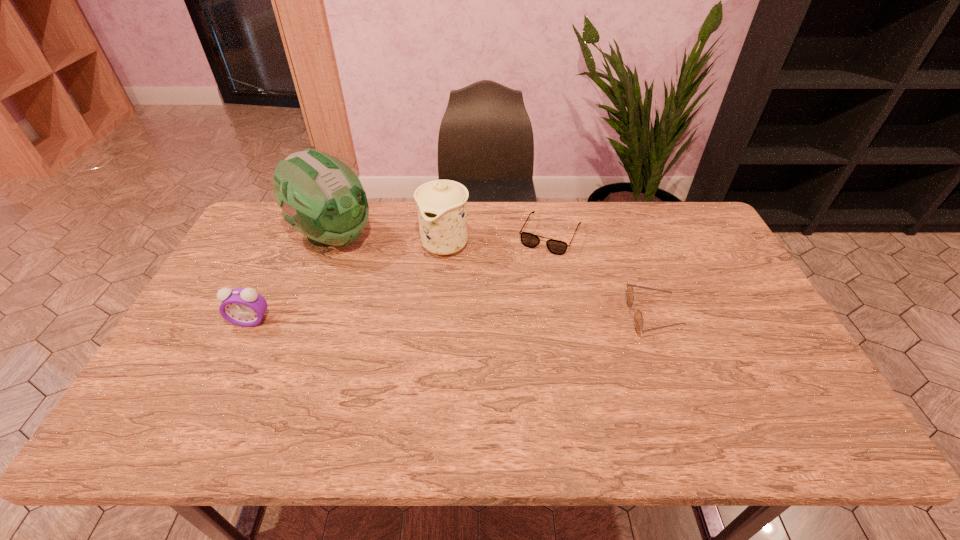
The height and width of the screenshot is (540, 960). Find the location of `football helmet located at the far edge`. football helmet located at the far edge is located at coordinates (321, 197).

You are a GUI agent. You are given a task and a screenshot of the screen. Output one action in this format:
    pyautogui.click(x=<x>, y=<y>)
    Task: Click on the spectacles that is positioned at the far edge
    This screenshot has height=540, width=960.
    Given the screenshot: What is the action you would take?
    pyautogui.click(x=557, y=247)

Find the location of a particular element. This screenshot has width=960, height=540. alarm clock that is at the left edge is located at coordinates (244, 307).

At what (x,y) coordinates should I click in order to perform the action: click on football helmet that is at the left edge. Please return your answer as a coordinate pair (x, y). The image size is (960, 540). Looking at the image, I should click on (321, 197).

Identify the location of object that is at the far left corner. This screenshot has width=960, height=540. (321, 197).

In the image, there is a desktop. At what (x,y) coordinates should I click in order to perform the action: click on vacant space at the far edge. Please return your answer as a coordinate pair (x, y). Looking at the image, I should click on (519, 219).

The height and width of the screenshot is (540, 960). Identify the location of vacant area at the near edge. (505, 399).

This screenshot has height=540, width=960. I want to click on free space at the left edge of the desktop, so [208, 316].

Locate an element on the screen. The width and height of the screenshot is (960, 540). free region at the right edge of the desktop is located at coordinates (717, 280).

Image resolution: width=960 pixels, height=540 pixels. Find the location of `vacant area at the far left corner of the desktop`. vacant area at the far left corner of the desktop is located at coordinates (276, 221).